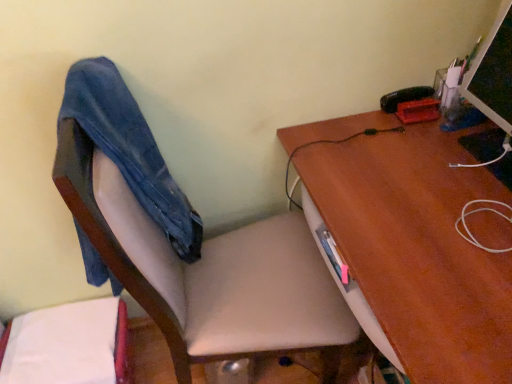
Question: From a real-world perspective, is matte black monitor at upper right beneath denim at left?

Choices:
 (A) no
 (B) yes

Answer: (A)

Question: Is denim at left inside matte black monitor at upper right?

Choices:
 (A) no
 (B) yes

Answer: (A)

Question: From a real-world perspective, is matte black monitor at upper right over denim at left?

Choices:
 (A) no
 (B) yes

Answer: (B)

Question: Does matte black monitor at upper right appear on the right side of denim at left?

Choices:
 (A) yes
 (B) no

Answer: (A)

Question: Could you tell me if matte black monitor at upper right is facing denim at left?

Choices:
 (A) no
 (B) yes

Answer: (B)

Question: Is point (61, 155) closer or farther from the camera than point (385, 228)?

Choices:
 (A) farther
 (B) closer

Answer: (B)

Question: From the image's perspective, relative to brown wood desk at upper right, is smooth beige chair at center above or below?

Choices:
 (A) below
 (B) above

Answer: (B)

Question: From a real-world perspective, is smooth beige chair at center physically located above or below brown wood desk at upper right?

Choices:
 (A) below
 (B) above

Answer: (B)

Question: Is smooth beige chair at center wider or thinner than brown wood desk at upper right?

Choices:
 (A) thin
 (B) wide

Answer: (A)

Question: Considering the relative positions of matte black monitor at upper right and denim at left in the image provided, is matte black monitor at upper right to the left or to the right of denim at left?

Choices:
 (A) left
 (B) right

Answer: (B)

Question: Considering the positions of matte black monitor at upper right and denim at left in the image, is matte black monitor at upper right bigger or smaller than denim at left?

Choices:
 (A) big
 (B) small

Answer: (B)

Question: Is point (495, 26) closer or farther from the camera than point (95, 112)?

Choices:
 (A) farther
 (B) closer

Answer: (A)

Question: Which is correct: matte black monitor at upper right is inside denim at left, or outside of it?

Choices:
 (A) outside
 (B) inside

Answer: (A)

Question: Based on their positions, is smooth beige chair at center located to the left or right of matte black monitor at upper right?

Choices:
 (A) left
 (B) right

Answer: (A)

Question: Is point (59, 163) closer or farther from the camera than point (495, 120)?

Choices:
 (A) farther
 (B) closer

Answer: (B)